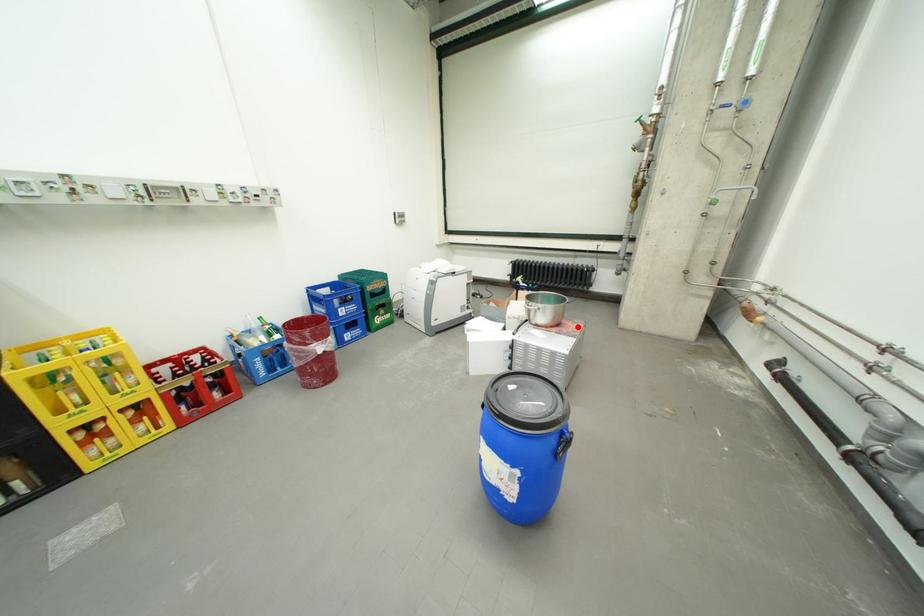
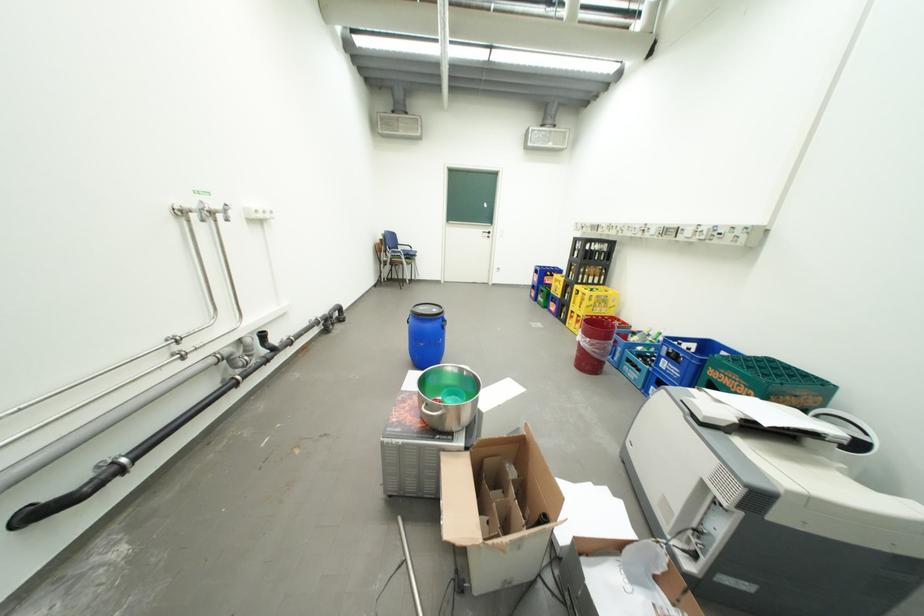
In the second image, find the point that corresponds to the highlighted location in the first image.

(422, 414)